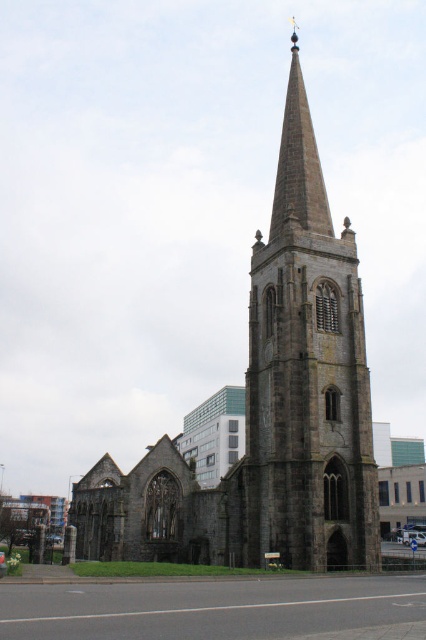
Does dark gray stone church at center have a greater width compared to dark gray stone tower at center?

Yes, dark gray stone church at center is wider than dark gray stone tower at center.

This screenshot has width=426, height=640. Find the location of `dark gray stone church at center`. dark gray stone church at center is located at coordinates (268, 410).

At what (x,y) coordinates should I click in order to perform the action: click on dark gray stone church at center. Please return your answer as a coordinate pair (x, y). Image resolution: width=426 pixels, height=640 pixels. Looking at the image, I should click on (268, 410).